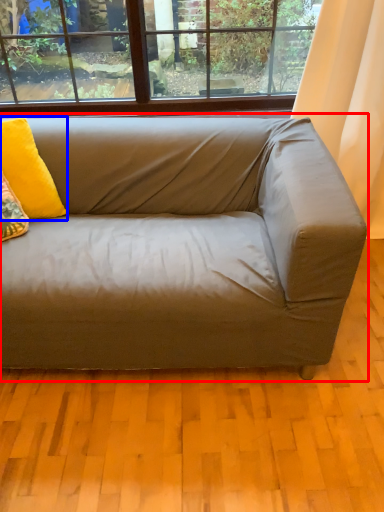
Question: Which object is further to the camera taking this photo, studio couch (highlighted by a red box) or pillow (highlighted by a blue box)?

Choices:
 (A) studio couch
 (B) pillow

Answer: (B)